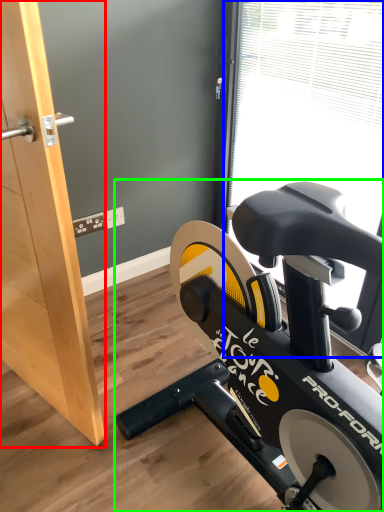
Question: Which object is the closest to the screen door (highlighted by a red box)? Choose among these: window screen (highlighted by a blue box) or stationary bicycle (highlighted by a green box).

Choices:
 (A) window screen
 (B) stationary bicycle

Answer: (B)